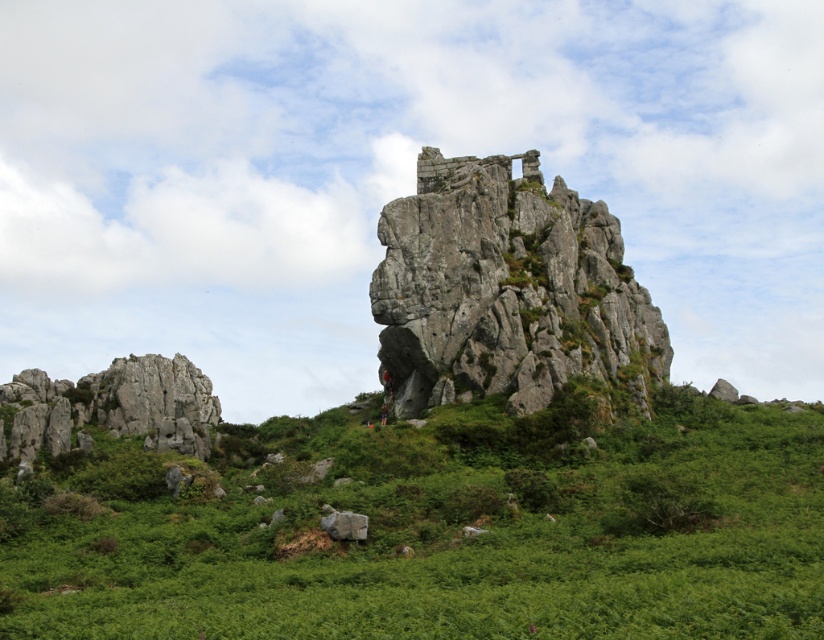
Question: Among these points, which one is farthest from the camera?

Choices:
 (A) (333, 509)
 (B) (586, 236)
 (C) (34, 417)

Answer: (C)

Question: Among these objects, which one is nearest to the camera?

Choices:
 (A) rugged stone mountain at center
 (B) gray rough rock at lower center
 (C) green grassy at lower left
 (D) rough stone rock at left

Answer: (C)

Question: Does rugged stone mountain at center have a lesser width compared to gray rough rock at lower center?

Choices:
 (A) yes
 (B) no

Answer: (B)

Question: Can you confirm if rough stone rock at left is wider than gray rough rock at lower center?

Choices:
 (A) no
 (B) yes

Answer: (B)

Question: Is green grassy at lower left positioned before gray rough rock at lower center?

Choices:
 (A) yes
 (B) no

Answer: (A)

Question: Which is farther from the green grassy at lower left?

Choices:
 (A) rugged stone mountain at center
 (B) gray rough rock at lower center

Answer: (A)